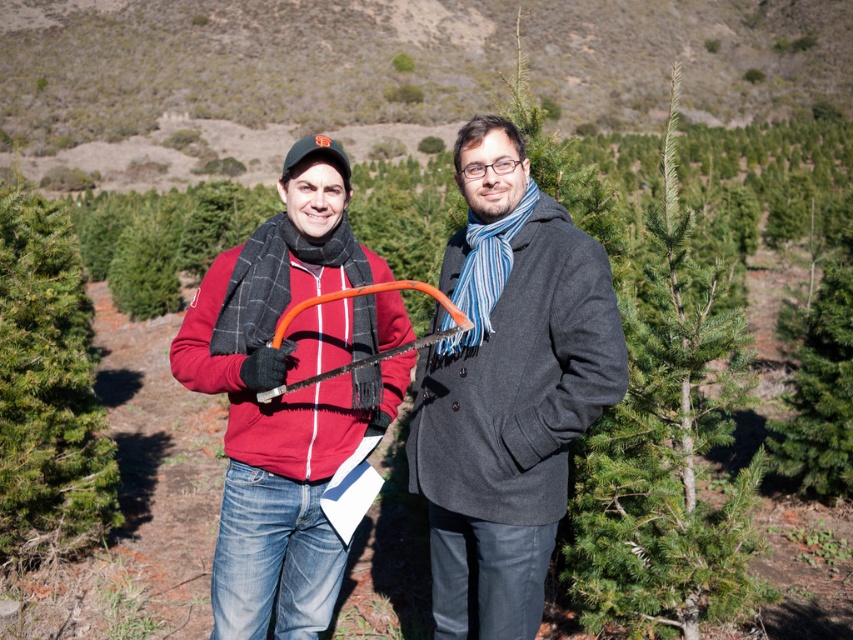
Question: Can you confirm if matte red sweater at center is positioned to the left of charcoal wool coat at center?

Choices:
 (A) yes
 (B) no

Answer: (A)

Question: Does matte red sweater at center appear over green needle-like at center?

Choices:
 (A) no
 (B) yes

Answer: (A)

Question: Which point is farther from the camera taking this photo?

Choices:
 (A) (294, 381)
 (B) (746, 490)
 (C) (532, 369)
 (D) (520, 406)

Answer: (B)

Question: Which of the following is the closest to the observer?

Choices:
 (A) charcoal wool coat at center
 (B) green needle-like at left

Answer: (A)

Question: Is matte red sweater at center to the right of charcoal wool coat at center from the viewer's perspective?

Choices:
 (A) no
 (B) yes

Answer: (A)

Question: Which object is the farthest from the green needle-like at center?

Choices:
 (A) charcoal wool coat at center
 (B) green needle-like at left

Answer: (B)